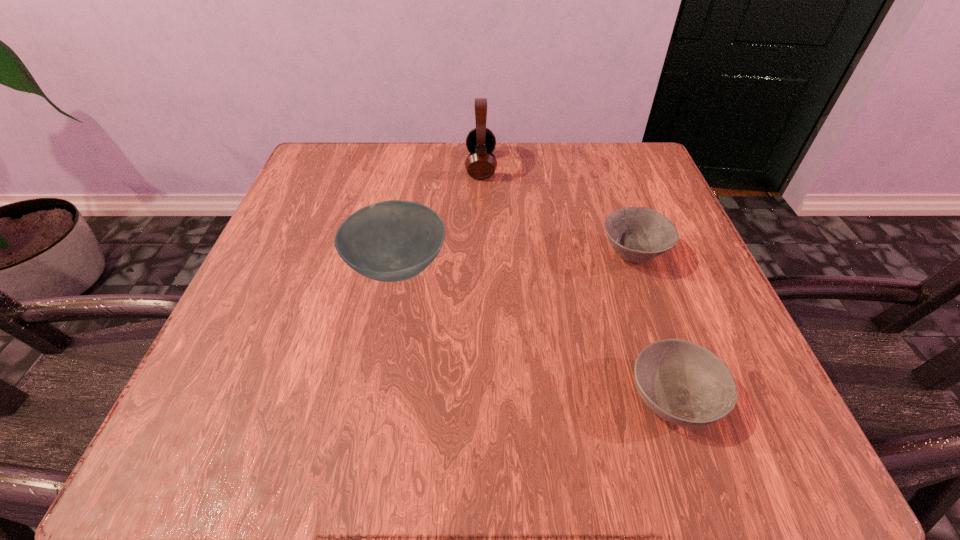
This screenshot has height=540, width=960. What are the coordinates of `vacant space that satisfies the following two spatial constraints: 1. on the ear pads of the tallest object; 2. on the left side of the nearest object` in the screenshot? It's located at (482, 396).

Identify the location of vacant point that satisfies the following two spatial constraints: 1. on the front side of the third shortest object; 2. on the right side of the shortest bowl. (372, 396).

Where is `free space that satisfies the following two spatial constraints: 1. on the back side of the nearest object; 2. on the left side of the second shortest object`? The width and height of the screenshot is (960, 540). free space that satisfies the following two spatial constraints: 1. on the back side of the nearest object; 2. on the left side of the second shortest object is located at coordinates (626, 255).